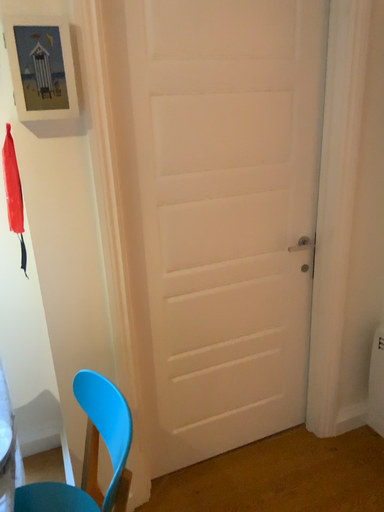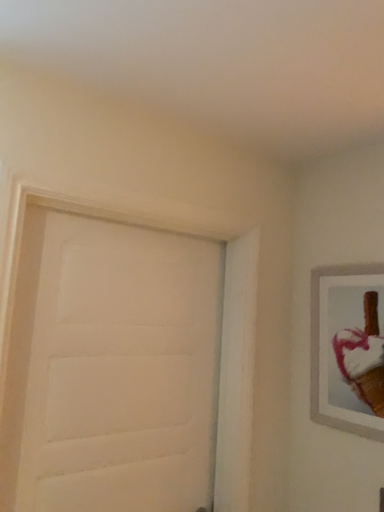
Question: How did the camera likely rotate when shooting the video?

Choices:
 (A) rotated right
 (B) rotated left

Answer: (A)